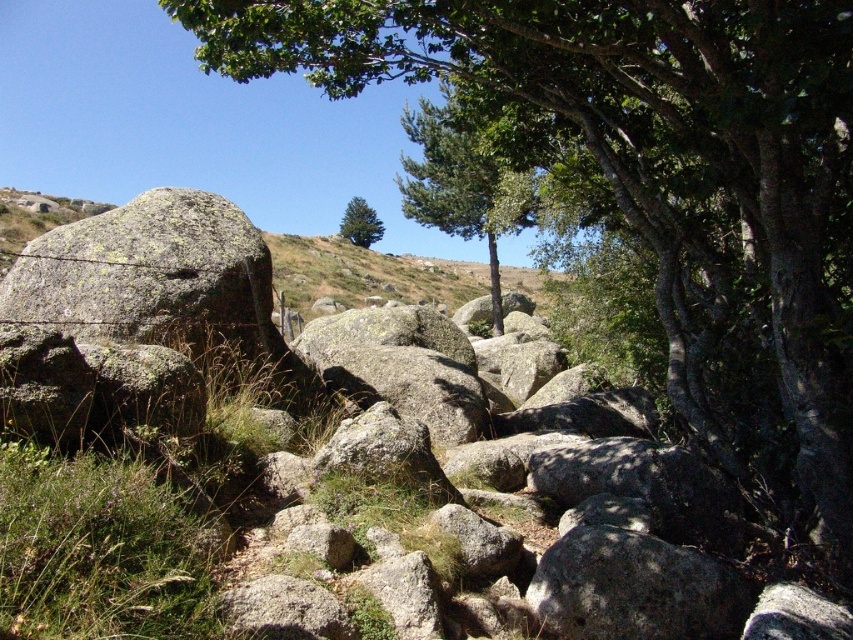
You are standing at the point with coordinates point (550, 628) and want to walk towards the point with coordinates point (177, 262). Which direction should you face to move directly towards it?

You should face north to move directly towards point (177, 262) from point (550, 628) because the first point is behind the second point.